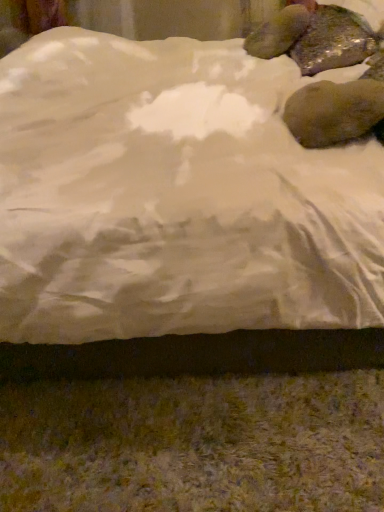
This screenshot has height=512, width=384. Describe the element at coordinates (178, 215) in the screenshot. I see `white satin bed at center` at that location.

You are a GUI agent. You are given a task and a screenshot of the screen. Output one action in this format:
    pyautogui.click(x=<x>, y=<y>)
    Task: Click on the white satin bed at center
    
    Given the screenshot: What is the action you would take?
    pyautogui.click(x=178, y=215)

What is the approximate width of white satin bed at center?

It is 7.71 feet.

The height and width of the screenshot is (512, 384). What are the coordinates of `brown matte rock at upper right` in the screenshot? It's located at (314, 38).

What do you see at coordinates (314, 38) in the screenshot? I see `brown matte rock at upper right` at bounding box center [314, 38].

Identify the location of white satin bed at center. The width and height of the screenshot is (384, 512). (178, 215).

Between brown matte rock at upper right and white satin bed at center, which one appears on the right side from the viewer's perspective?

Positioned to the right is brown matte rock at upper right.

Is brown matte rock at upper right behind white satin bed at center?

Yes, brown matte rock at upper right is further from the viewer.

Considering the positions of point (346, 109) and point (276, 66), is point (346, 109) closer or farther from the camera than point (276, 66)?

Point (346, 109) appears to be closer to the viewer than point (276, 66).

From the image's perspective, is brown matte rock at upper right above or below white satin bed at center?

brown matte rock at upper right is situated lower than white satin bed at center in the image.

From a real-world perspective, relative to white satin bed at center, is brown matte rock at upper right vertically above or below?

In terms of real-world spatial position, brown matte rock at upper right is above white satin bed at center.

Considering the relative sizes of brown matte rock at upper right and white satin bed at center in the image provided, is brown matte rock at upper right thinner than white satin bed at center?

Yes, brown matte rock at upper right is thinner than white satin bed at center.

Who is shorter, brown matte rock at upper right or white satin bed at center?

Standing shorter between the two is brown matte rock at upper right.

Considering the sizes of objects brown matte rock at upper right and white satin bed at center in the image provided, who is smaller, brown matte rock at upper right or white satin bed at center?

brown matte rock at upper right is smaller.

Based on the photo, which is correct: brown matte rock at upper right is inside white satin bed at center, or outside of it?

brown matte rock at upper right can be found inside white satin bed at center.

Is brown matte rock at upper right next to white satin bed at center and touching it?

There is a gap between brown matte rock at upper right and white satin bed at center.

Is white satin bed at center at the back of brown matte rock at upper right?

Yes, brown matte rock at upper right's orientation is away from white satin bed at center.

How different are the orientations of brown matte rock at upper right and white satin bed at center in degrees?

The facing directions of brown matte rock at upper right and white satin bed at center are 25.9 degrees apart.

What are the coordinates of `animal that appears above the white satin bed at center (from a real-world perspective)` in the screenshot? It's located at (314, 38).

Which is more to the left, white satin bed at center or brown matte rock at upper right?

white satin bed at center.

Consider the image. Is white satin bed at center behind brown matte rock at upper right?

No, white satin bed at center is in front of brown matte rock at upper right.

Which is behind, point (278, 116) or point (324, 86)?

Positioned behind is point (278, 116).

From the image's perspective, is white satin bed at center located above or below brown matte rock at upper right?

From the image's perspective, white satin bed at center appears above brown matte rock at upper right.

From a real-world perspective, is white satin bed at center positioned above or below brown matte rock at upper right?

Clearly, from a real-world perspective, white satin bed at center is below brown matte rock at upper right.

Which of these two, white satin bed at center or brown matte rock at upper right, is thinner?

→ With smaller width is brown matte rock at upper right.

Who is taller, white satin bed at center or brown matte rock at upper right?

white satin bed at center is taller.

Considering the relative sizes of white satin bed at center and brown matte rock at upper right in the image provided, is white satin bed at center smaller than brown matte rock at upper right?

No, white satin bed at center is not smaller than brown matte rock at upper right.

Is white satin bed at center situated inside brown matte rock at upper right or outside?

white satin bed at center is spatially situated outside brown matte rock at upper right.

Looking at this image, are white satin bed at center and brown matte rock at upper right beside each other?

No, white satin bed at center is not next to brown matte rock at upper right.

Is white satin bed at center oriented towards brown matte rock at upper right?

No, white satin bed at center is not aimed at brown matte rock at upper right.

Can you tell me how much white satin bed at center and brown matte rock at upper right differ in facing direction?

25.9 degrees separate the facing orientations of white satin bed at center and brown matte rock at upper right.

Measure the distance between white satin bed at center and brown matte rock at upper right.

A distance of 17.46 inches exists between white satin bed at center and brown matte rock at upper right.

Identify the location of bed that appears below the brown matte rock at upper right (from a real-world perspective). The height and width of the screenshot is (512, 384). (178, 215).

Where is `bed below the brown matte rock at upper right (from a real-world perspective)`? bed below the brown matte rock at upper right (from a real-world perspective) is located at coordinates (178, 215).

The width and height of the screenshot is (384, 512). Identify the location of animal on the right of the white satin bed at center. click(x=314, y=38).